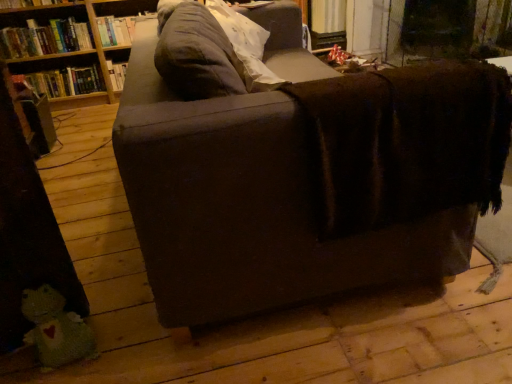
Question: From the image's perspective, is hardcover book at upper left, the second book from the bottom, above or below hardcover book at left, which is the first book from bottom to top?

Choices:
 (A) above
 (B) below

Answer: (A)

Question: Looking at their shapes, would you say hardcover book at upper left, which ranks as the 2th book in top-to-bottom order, is wider or thinner than hardcover book at left, which is the first book from bottom to top?

Choices:
 (A) thin
 (B) wide

Answer: (B)

Question: Estimate the real-world distances between objects in this image. Which object is closer to the hardcover book at upper left, which appears as the 3th book when ordered from the bottom?

Choices:
 (A) soft gray pillow at upper center
 (B) green knitted toy at lower left
 (C) hardcover book at left, the third book in the top-to-bottom sequence
 (D) hardcover book at upper left, which ranks as the 2th book in top-to-bottom order
 (E) brown fabric shelf at upper left

Answer: (D)

Question: Considering the real-world distances, which object is farthest from the dark brown fabric couch at center?

Choices:
 (A) hardcover book at left, the third book in the top-to-bottom sequence
 (B) soft gray pillow at upper center
 (C) brown fabric shelf at upper left
 (D) green knitted toy at lower left
 (E) hardcover book at upper left, the second book from the bottom

Answer: (A)